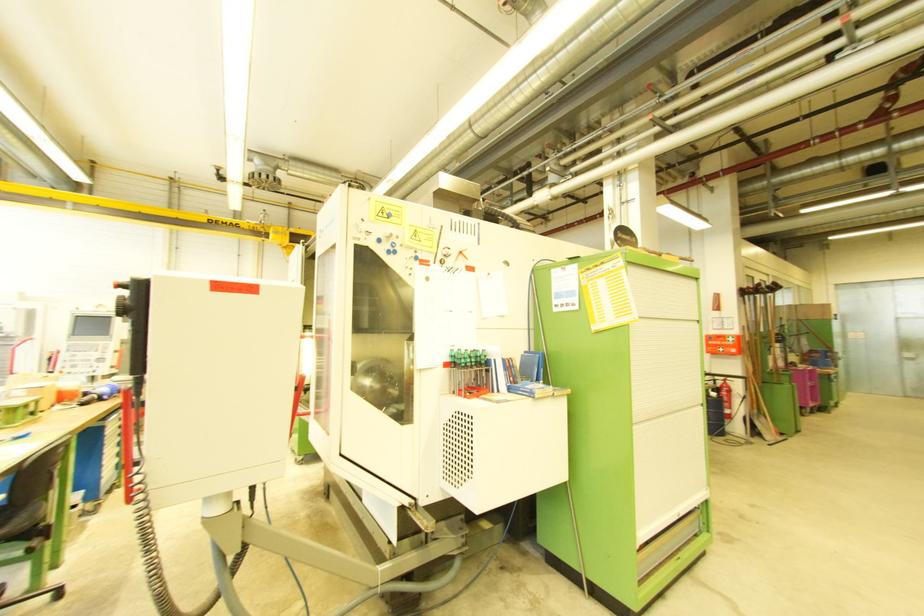
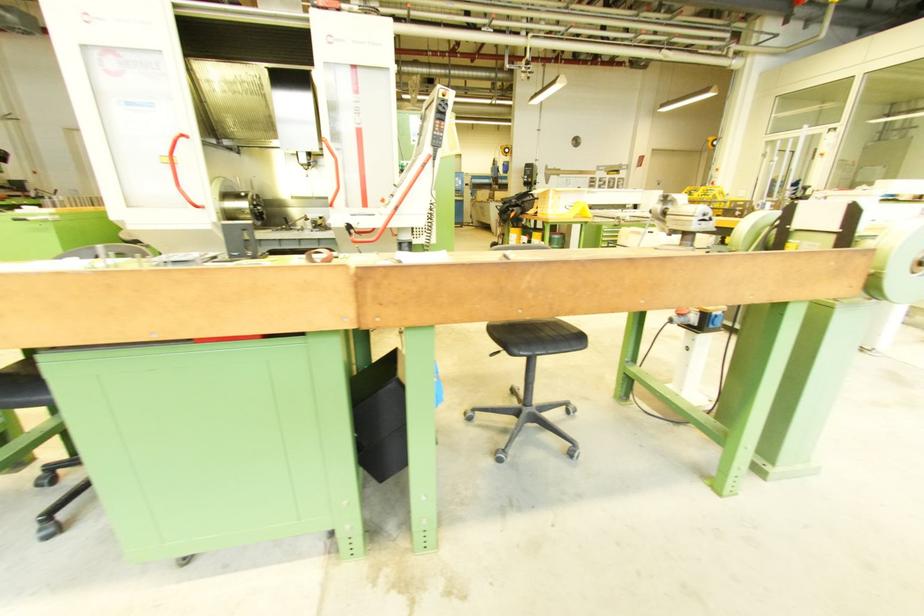
Question: I am providing you with two images of the same scene from different viewpoints. After the viewpoint changes to image2, which objects are now occluded?

Choices:
 (A) green handle screwdriver
 (B) metal vise handle
 (C) white mattress tag
 (D) red machine handle

Answer: (A)